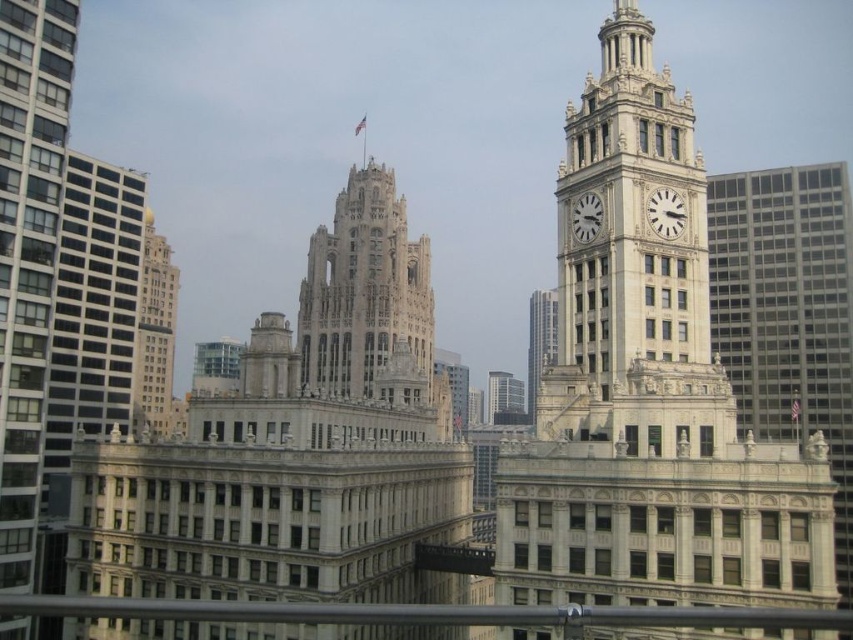
You are standing in the cityscape and want to take a photo. There are two points of interest marked as point 1 at coordinates (x=508, y=404) and point 2 at (x=579, y=232). Which point is closer to your camera position?

Point 1 at coordinates (x=508, y=404) is further to the camera than point 2 at (x=579, y=232), so point 2 is closer to the camera.

You are standing at the camera position and want to take a photo of the white stone tower at center. If your camera has a maximum zoom range of 100 meters, can you capture the tower in full without moving closer?

The white stone tower at center is 198.28 meters away from the camera. Since the camera can only zoom up to 100 meters, you cannot capture the tower in full without moving closer.